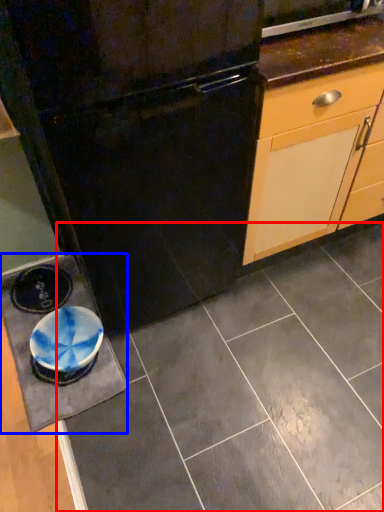
Question: Which object appears closest to the camera in this image, ceramic tile (highlighted by a red box) or slate (highlighted by a blue box)?

Choices:
 (A) ceramic tile
 (B) slate

Answer: (A)